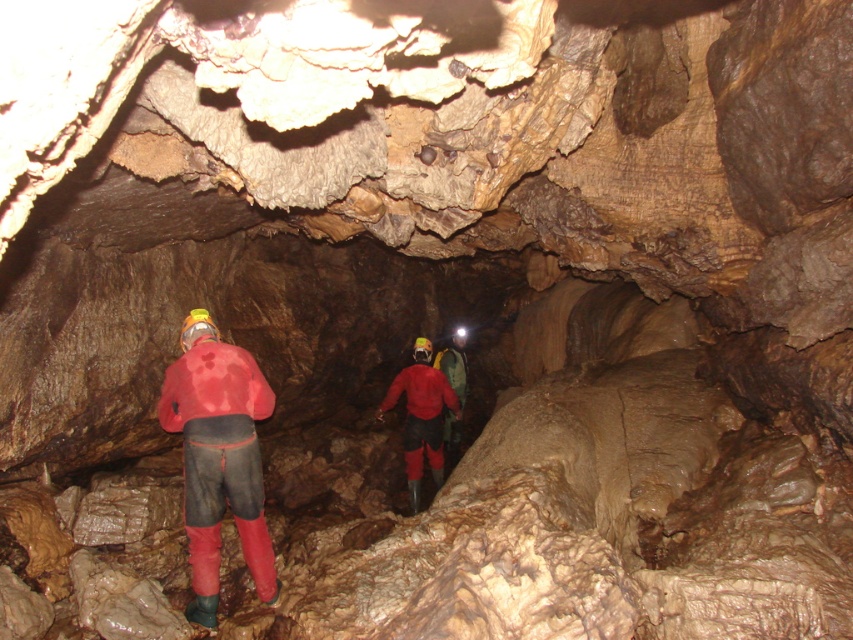
You are a caver preparing to enter the cave. You have a backpack with limited space. You need to decide whether to bring the rubberized red suit at center or the red rubber boots at center. Based on their sizes, which one takes up more space?

The rubberized red suit at center is wider than the red rubber boots at center, so it takes up more space.

You are a caver in the cave and want to move from point A to point B. Point A is at coordinate point (195, 586) and point B is at coordinate point (425, 428). Which point is closer to you when you start at point A?

Point A at coordinate point (195, 586) is closer to you since it is your starting position, while point B at coordinate point (425, 428) is further away.